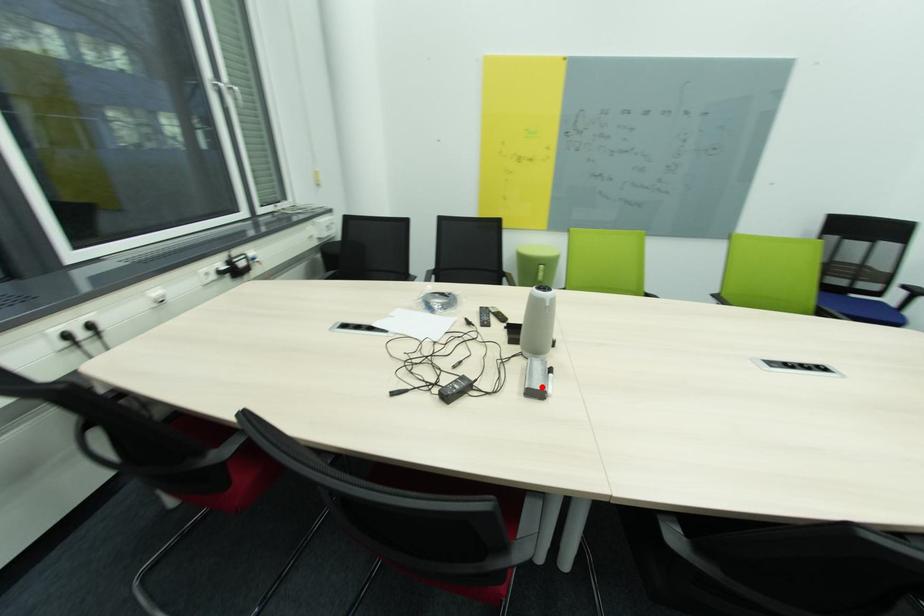
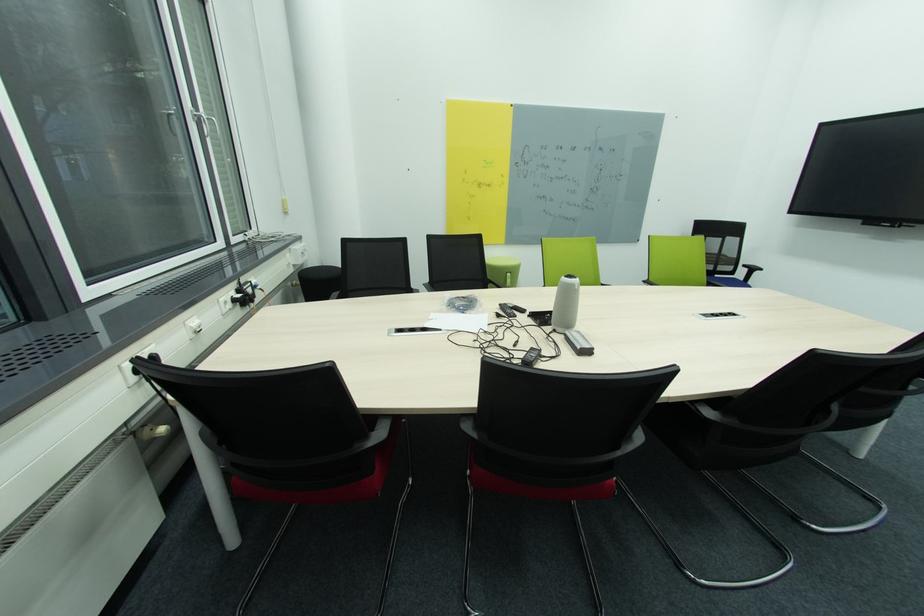
The point at the highlighted location is marked in the first image. Where is the corresponding point in the second image?

(591, 347)